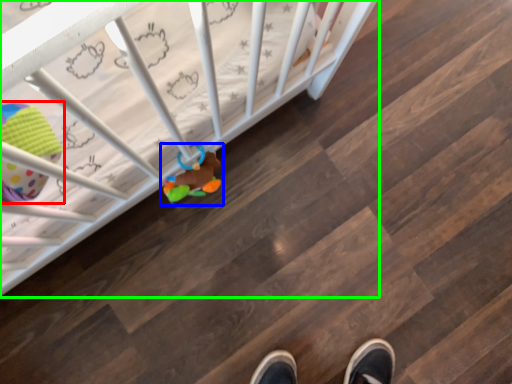
Question: Which object is the closest to the toy (highlighted by a red box)? Choose among these: toy (highlighted by a blue box) or infant bed (highlighted by a green box).

Choices:
 (A) toy
 (B) infant bed

Answer: (B)